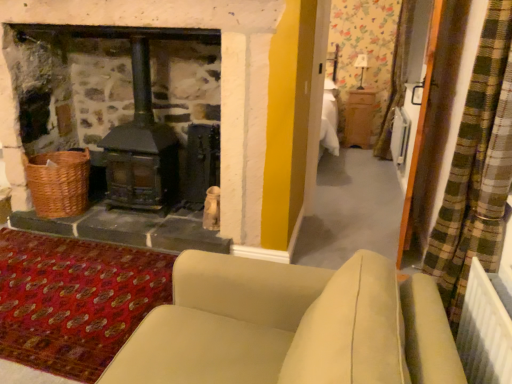
Question: Looking at their shapes, would you say beige fabric couch at lower center is wider or thinner than woven brown basket at lower left?

Choices:
 (A) wide
 (B) thin

Answer: (A)

Question: From their relative heights in the image, would you say beige fabric couch at lower center is taller or shorter than woven brown basket at lower left?

Choices:
 (A) short
 (B) tall

Answer: (B)

Question: Which of these objects is positioned farthest from the beige fabric couch at lower center?

Choices:
 (A) woven brown basket at lower left
 (B) white plastic screen door at right
 (C) black matte wood burning stove at left

Answer: (A)

Question: Which object is positioned closest to the woven brown basket at lower left?

Choices:
 (A) black matte wood burning stove at left
 (B) beige fabric couch at lower center
 (C) white plastic screen door at right

Answer: (A)